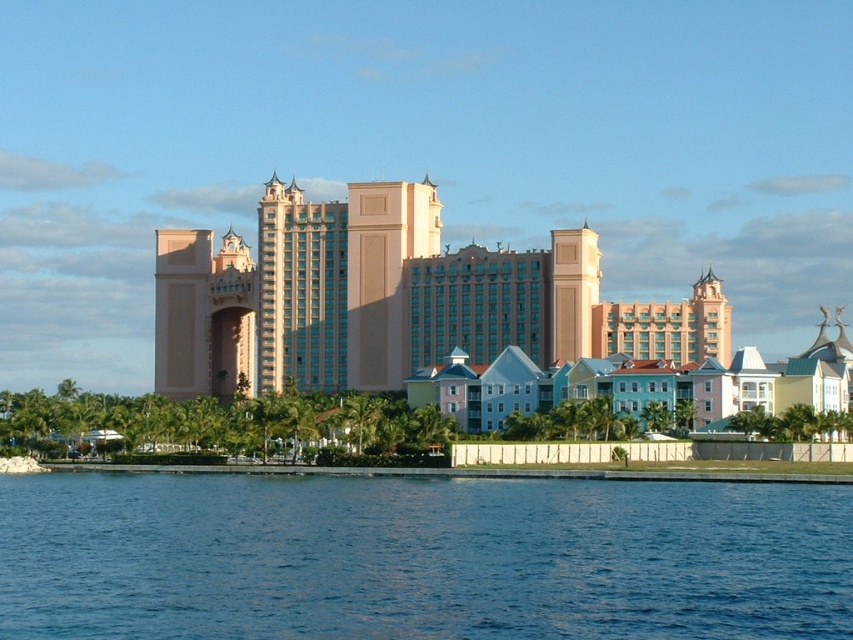
You are a photographer planning to capture the waterfront scene. You want to ensure that both the blue liquid water at lower center and the pink smooth building at center are clearly visible in your shot. Given their spatial relationship, which object will appear narrower in the photograph?

The blue liquid water at lower center will appear narrower in the photograph because it is thinner than the pink smooth building at center.

You are a tourist standing at the waterfront and want to take a photo that includes both the blue liquid water at lower center and the pink smooth building at center. Which object will appear larger in the photo?

The pink smooth building at center will appear larger in the photo since it occupies more space than the blue liquid water at lower center according to the description.